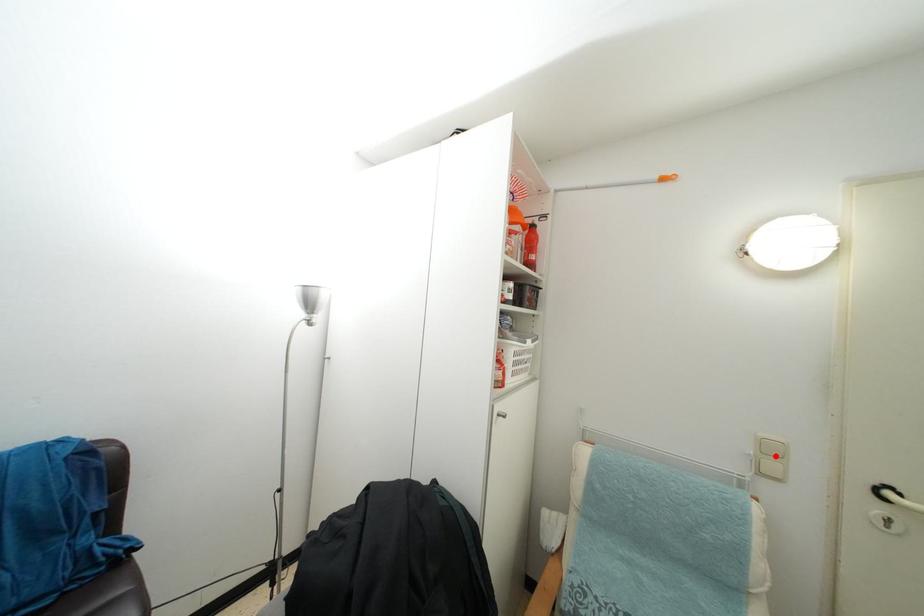
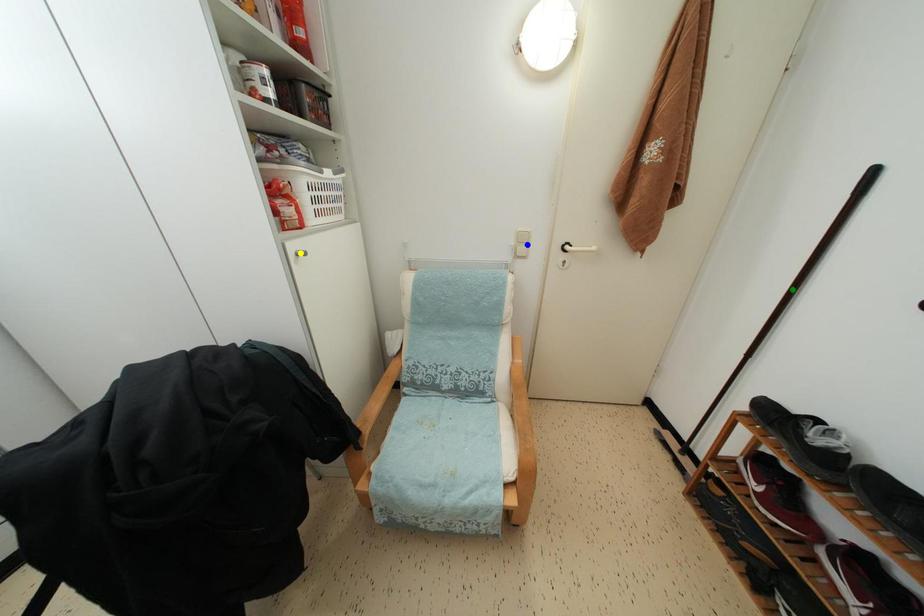
Question: I am providing you with two images of the same scene from different viewpoints. A red point is marked on the first image. You are given multiple points on the second image. Which point in image 2 represents the same 3d spot as the red point in image 1?

Choices:
 (A) yellow point
 (B) blue point
 (C) green point

Answer: (B)